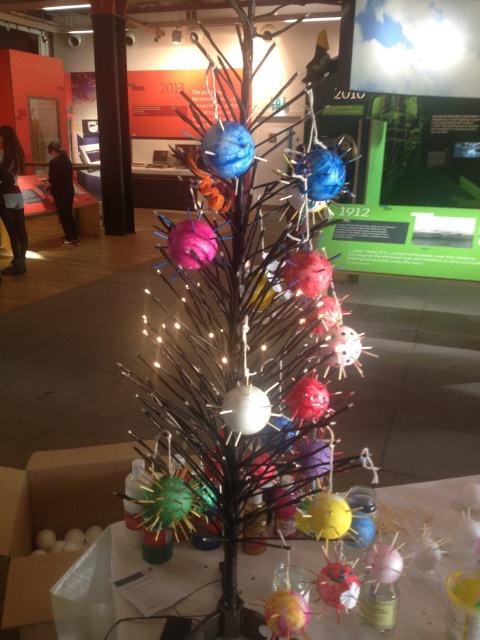
Question: Is metallic wire tree at center below translucent plastic table at lower center?

Choices:
 (A) yes
 (B) no

Answer: (B)

Question: Which point is farther to the camera?

Choices:
 (A) translucent plastic table at lower center
 (B) metallic wire tree at center

Answer: (A)

Question: Where is metallic wire tree at center located in relation to translucent plastic table at lower center in the image?

Choices:
 (A) below
 (B) above

Answer: (B)

Question: Can you confirm if metallic wire tree at center is smaller than translucent plastic table at lower center?

Choices:
 (A) no
 (B) yes

Answer: (A)

Question: Which of the following is the farthest from the observer?

Choices:
 (A) (248, 525)
 (B) (457, 481)

Answer: (B)